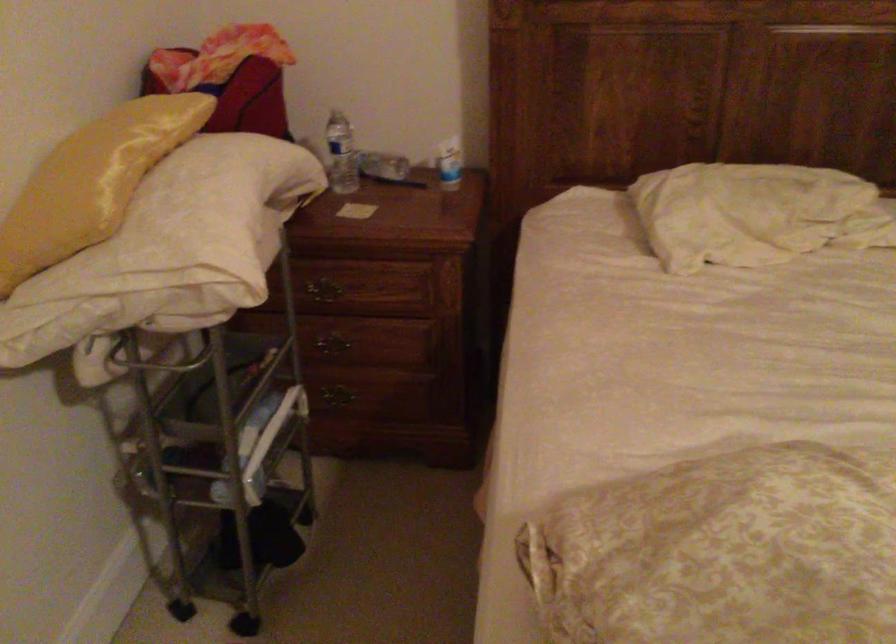
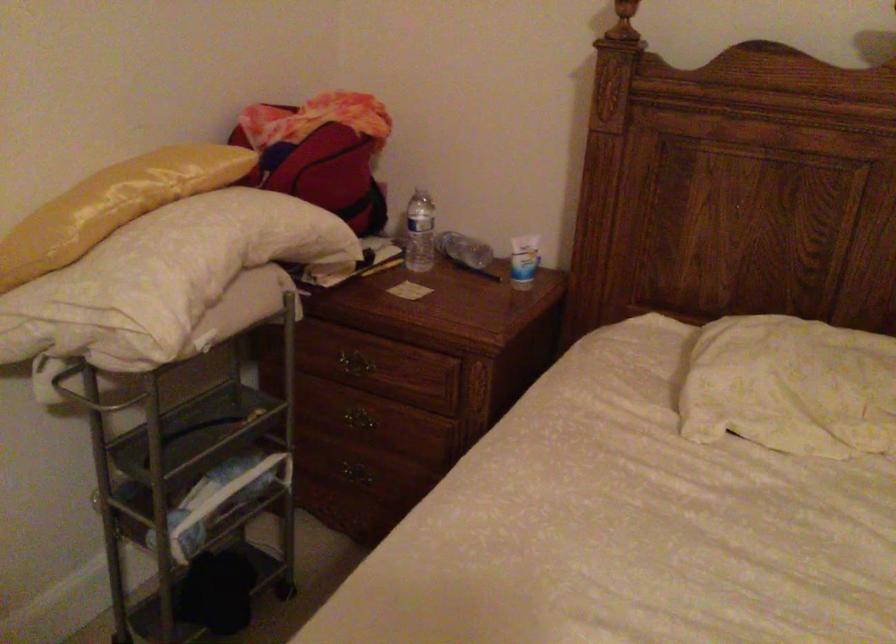
Locate, in the second image, the point that corresponds to point (332, 351) in the first image.

(357, 426)